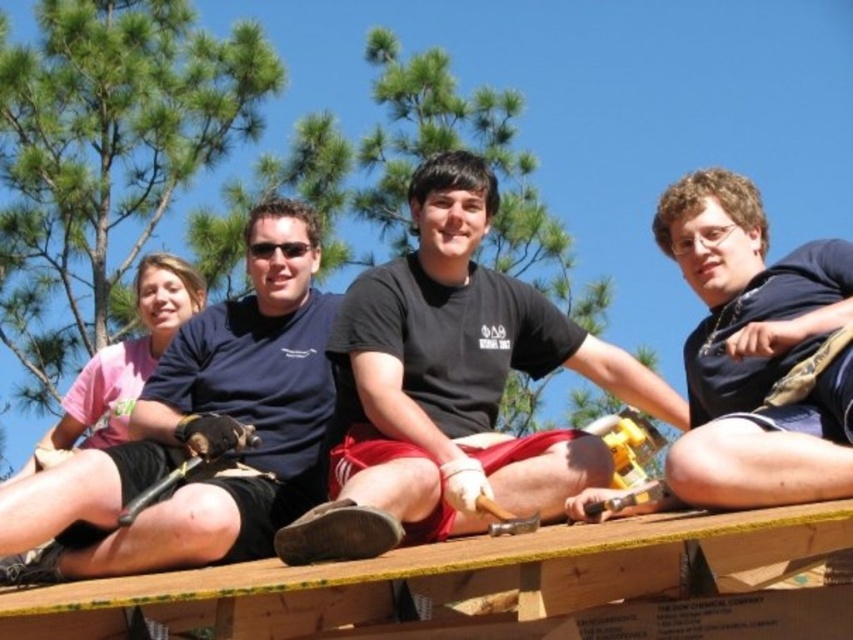
You are standing at point (693, 483) and want to walk to point (405, 436). Is the destination point in front of you or behind you?

The destination point (405, 436) is behind point (693, 483), so it is behind you.

You are standing in the scene and want to move from the point at coordinates point (390,355) to the point at coordinates point (280,513). Which direction should you move to get closer to the latter?

Since point (390,355) is further to the viewer than point (280,513), you should move forward towards the latter point to get closer.